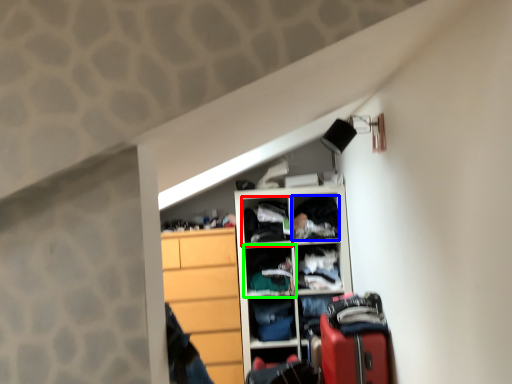
Question: Considering the real-world distances, which object is closest to cabinet (highlighted by a red box)? clothing (highlighted by a blue box) or shelf (highlighted by a green box).

Choices:
 (A) clothing
 (B) shelf

Answer: (B)